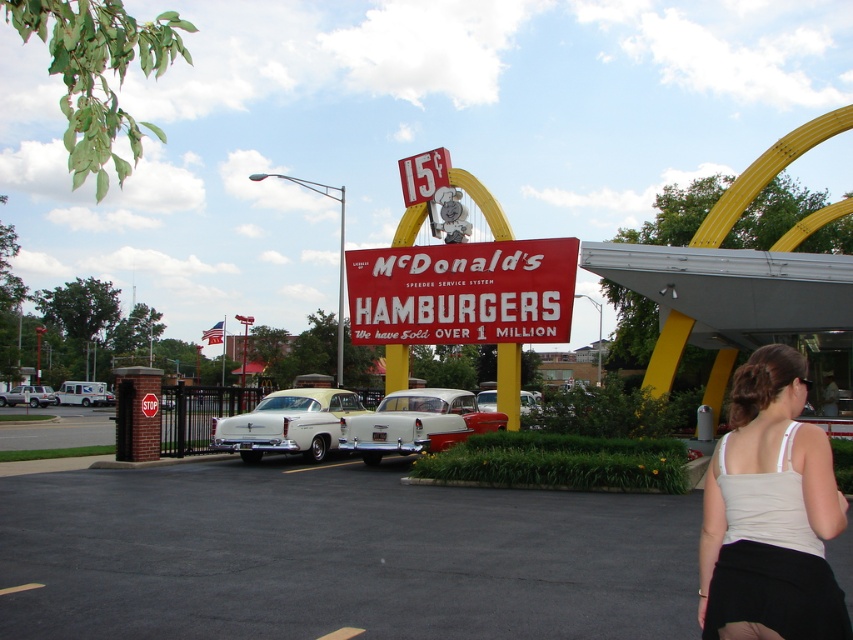
Does black asphalt parking lot at lower center appear over matte silver sedan at center?

Yes.

Between black asphalt parking lot at lower center and matte silver sedan at center, which one is positioned higher?

black asphalt parking lot at lower center is above.

The image size is (853, 640). What do you see at coordinates (337, 556) in the screenshot? I see `black asphalt parking lot at lower center` at bounding box center [337, 556].

Find the location of a particular element. black asphalt parking lot at lower center is located at coordinates (337, 556).

Who is positioned more to the left, black asphalt parking lot at lower center or light beige tank top at lower right?

From the viewer's perspective, black asphalt parking lot at lower center appears more on the left side.

This screenshot has width=853, height=640. What do you see at coordinates (337, 556) in the screenshot? I see `black asphalt parking lot at lower center` at bounding box center [337, 556].

Is point (138, 488) farther from camera compared to point (746, 433)?

Yes, point (138, 488) is behind point (746, 433).

You are a GUI agent. You are given a task and a screenshot of the screen. Output one action in this format:
    pyautogui.click(x=<x>, y=<y>)
    Task: Click on the black asphalt parking lot at lower center
    This screenshot has width=853, height=640.
    Given the screenshot: What is the action you would take?
    pyautogui.click(x=337, y=556)

Which of these two, black asphalt parking lot at lower center or white matte van at left, stands shorter?

white matte van at left

Is point (44, 474) closer to camera compared to point (83, 384)?

Yes, point (44, 474) is closer to viewer.

Describe the element at coordinates (337, 556) in the screenshot. The height and width of the screenshot is (640, 853). I see `black asphalt parking lot at lower center` at that location.

Locate an element on the screen. black asphalt parking lot at lower center is located at coordinates (337, 556).